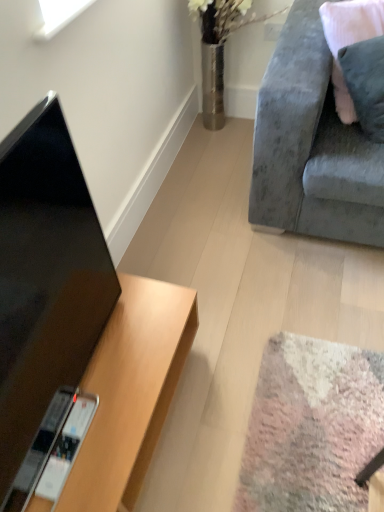
Where is `free space in front of velvet grey couch at upper right`? The height and width of the screenshot is (512, 384). free space in front of velvet grey couch at upper right is located at coordinates tap(297, 312).